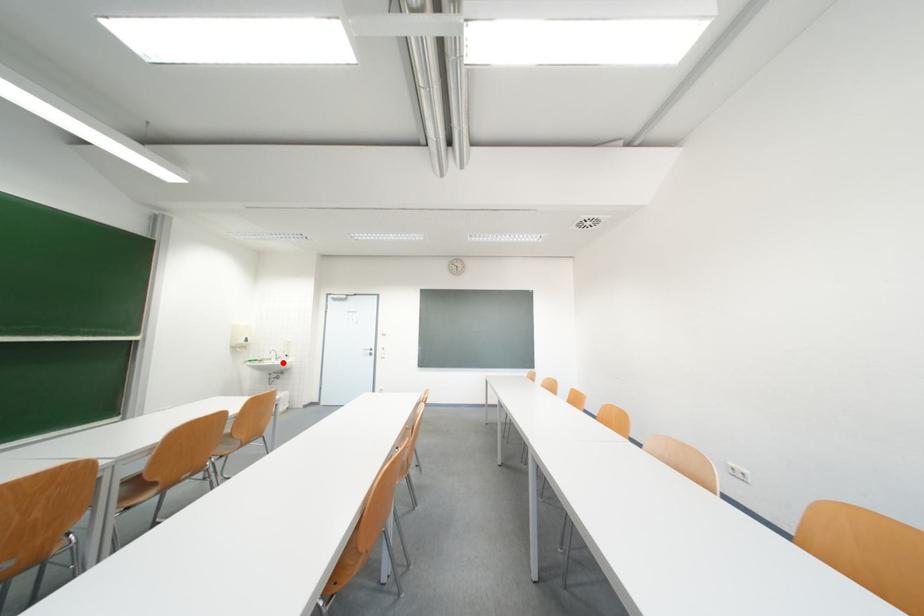
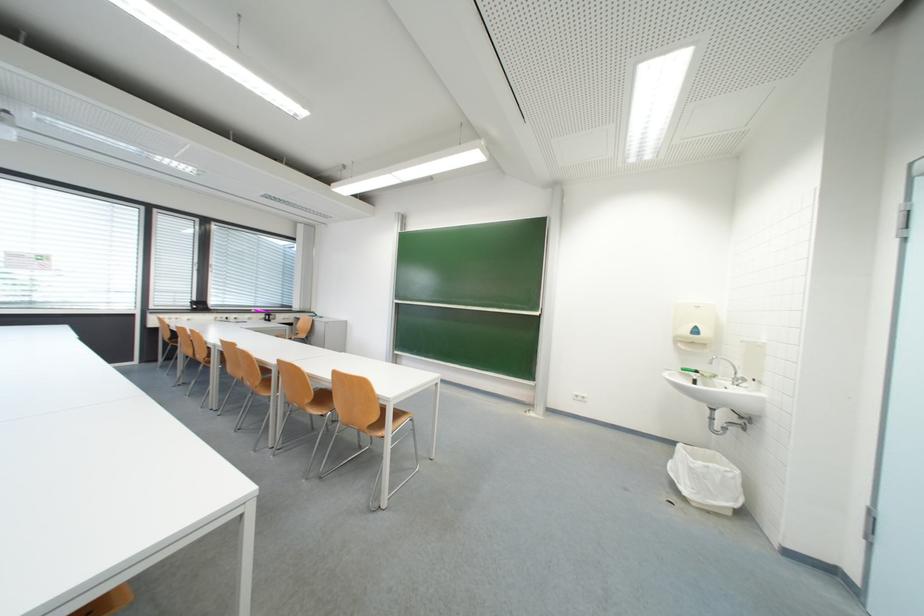
Find the pixel in the second image that matches the highlighted location in the first image.

(736, 385)